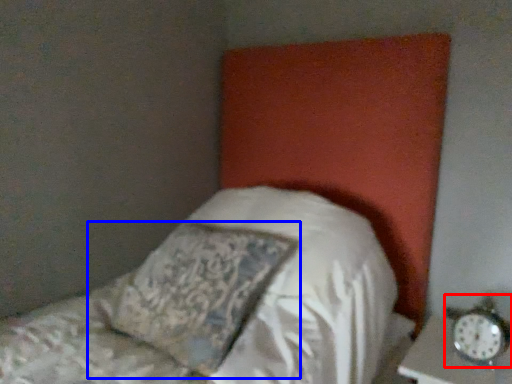
Question: Which point is further to the camera, alarm clock (highlighted by a red box) or pillow (highlighted by a blue box)?

Choices:
 (A) alarm clock
 (B) pillow

Answer: (A)